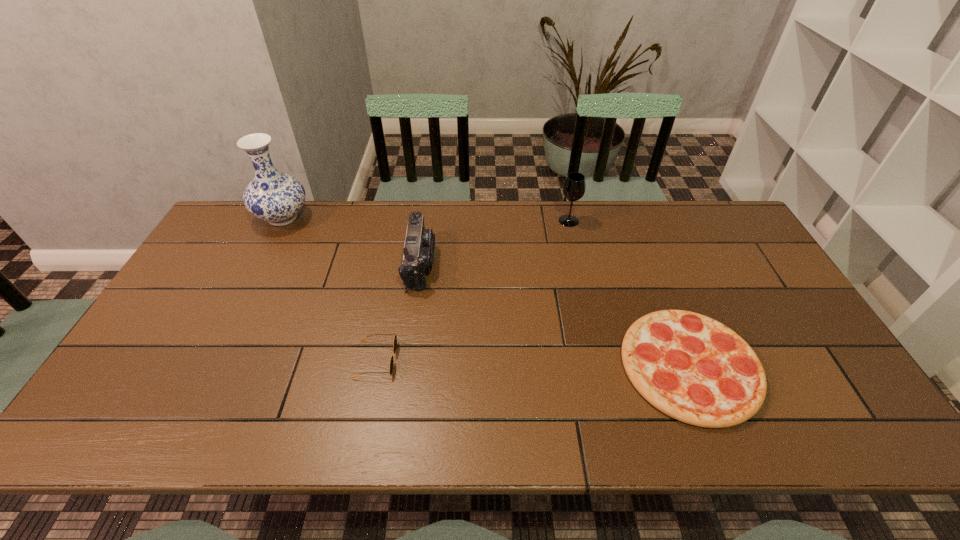
You are a GUI agent. You are given a task and a screenshot of the screen. Output one action in this format:
    pyautogui.click(x=<x>, y=<y>)
    Task: Click on the vacant space located 0.400m on the front of the fourth shortest object
    
    Given the screenshot: What is the action you would take?
    pyautogui.click(x=591, y=320)

The width and height of the screenshot is (960, 540). What are the coordinates of `vacant point located on the front-facing side of the third farthest object` in the screenshot? It's located at (454, 264).

I want to click on free space located 0.270m on the front-facing side of the second shortest object, so (504, 359).

Locate an element on the screen. This screenshot has height=540, width=960. vacant space located 0.100m on the back of the pizza is located at coordinates (659, 288).

In order to click on vase located in the far edge section of the desktop in this screenshot , I will do `click(273, 196)`.

Locate an element on the screen. This screenshot has width=960, height=540. wineglass positioned at the far edge is located at coordinates (574, 187).

Find the location of a particular element. camcorder present at the far edge is located at coordinates (418, 254).

Where is `object present at the near edge`? The width and height of the screenshot is (960, 540). object present at the near edge is located at coordinates (691, 367).

This screenshot has width=960, height=540. In order to click on object that is at the left edge in this screenshot , I will do `click(273, 196)`.

Find the location of `object located in the far left corner section of the desktop`. object located in the far left corner section of the desktop is located at coordinates (273, 196).